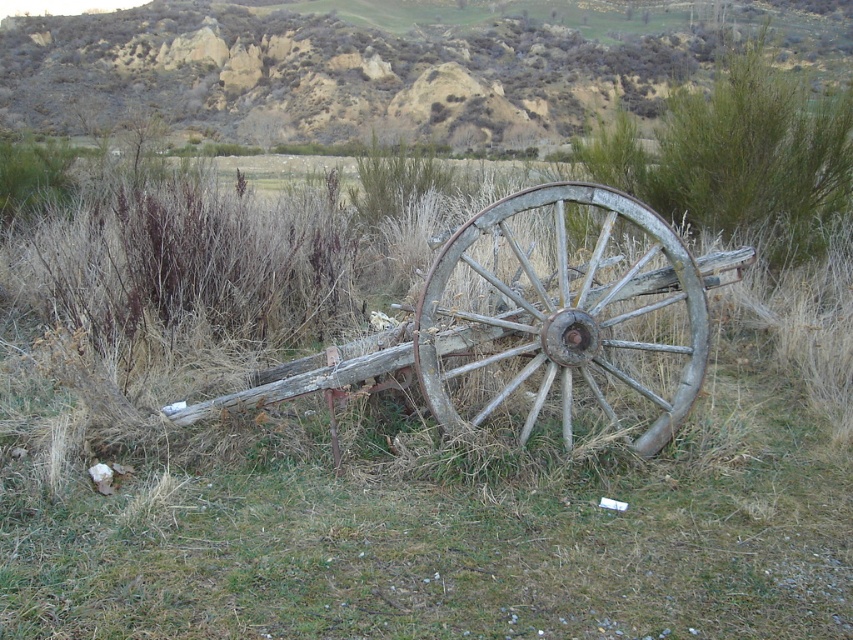
You are a hiker planning to climb the brown textured hillside at upper center and then walk to the weathered wood cart at center. Which part of the journey will require more effort due to elevation changes?

The climb to the brown textured hillside at upper center will require more effort because it has a greater height compared to the weathered wood cart at center.

You are a farmer who needs to transport both the weathered wood cart at center and the weathered wood wagon wheel at center in the back of your pickup truck. The truck bed is 1.5 meters wide. Can both items fit side by side without overlapping?

The weathered wood cart at center is wider than the weathered wood wagon wheel at center. Since the truck bed is only 1.5 meters wide, and the cart alone is already wider than the wagon wheel, there might not be enough space for both items to fit side by side without overlapping. The exact feasibility depends on the cart and wheel dimensions, but given the cart is wider, it likely occupies more than half the truck bed width, leaving insufficient space for the wagon wheel.

Based on the photo, you are standing in the field and want to take a photo of the weathered wood cart at center. To avoid having the brown textured hillside at upper center appear in the background, which direction should you move relative to the cart?

You should move to the right side of the weathered wood cart at center because the brown textured hillside at upper center is positioned over it, so moving sideways away from the hillside would frame the cart without the hillside in the background.